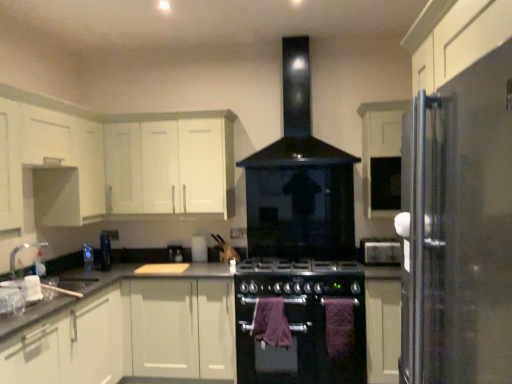
Question: Considering the positions of point (314, 279) and point (174, 248), is point (314, 279) closer or farther from the camera than point (174, 248)?

Choices:
 (A) farther
 (B) closer

Answer: (B)

Question: In terms of height, does black matte gas stove at center look taller or shorter compared to satin black kettle at center, which appears as the 1th appliance when viewed from the back?

Choices:
 (A) tall
 (B) short

Answer: (A)

Question: Which object is the closest to the white matte cabinet at lower right, which is the 4th cabinetry from left to right?

Choices:
 (A) white matte cabinet at lower left, arranged as the 2th cabinetry when viewed from the left
 (B) black matte gas stove at center
 (C) white matte cabinet at upper right, which appears as the 1th cabinetry when viewed from the right
 (D) black glass exhaust hood at center
 (E) granite gray countertop at center

Answer: (B)

Question: Based on their relative distances, which object is nearer to the granite gray countertop at center?

Choices:
 (A) black matte oven at center
 (B) white matte cabinet at upper right, which is the fifth cabinetry from left to right
 (C) white matte cabinet at upper left, the 3th cabinetry from the left
 (D) black matte gas stove at center
 (E) purple fabric towel at center, the second blanket in the right-to-left sequence

Answer: (D)